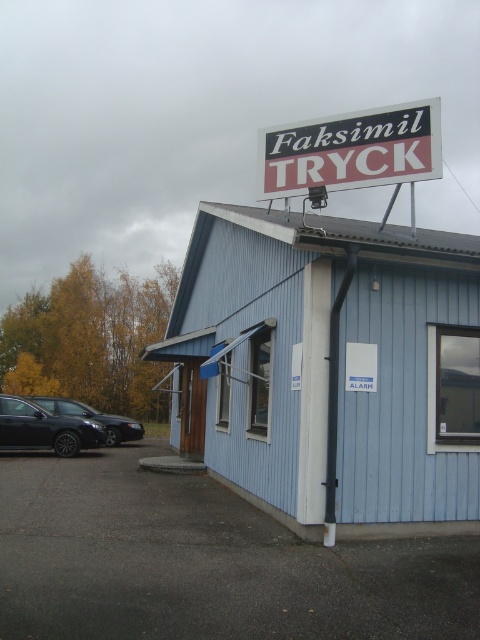
What do you see at coordinates (351, 150) in the screenshot? I see `black plastic sign at upper center` at bounding box center [351, 150].

Who is more forward, [358,177] or [52,404]?

Point [358,177] is in front.

Is point (386, 160) less distant than point (63, 410)?

Yes, point (386, 160) is in front of point (63, 410).

Where is `black plastic sign at upper center`? The height and width of the screenshot is (640, 480). black plastic sign at upper center is located at coordinates (351, 150).

Is gray asphalt parking lot at lower left in front of matte black car at left?

Yes, gray asphalt parking lot at lower left is closer to the viewer.

Which is behind, point (97, 532) or point (104, 413)?

The point (104, 413) is behind.

Identify the location of gray asphalt parking lot at lower left. (204, 561).

Which is behind, point (192, 593) or point (295, 125)?

Point (295, 125)

Who is more distant from viewer, (12, 476) or (267, 150)?

The point (12, 476) is more distant.

Image resolution: width=480 pixels, height=640 pixels. I want to click on gray asphalt parking lot at lower left, so click(204, 561).